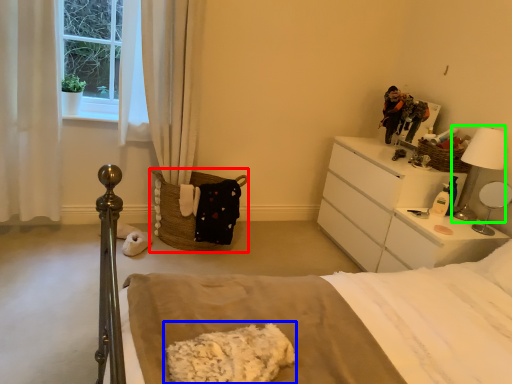
Question: Considering the real-world distances, which object is closest to basket (highlighted by a red box)? material (highlighted by a blue box) or table lamp (highlighted by a green box).

Choices:
 (A) material
 (B) table lamp

Answer: (A)